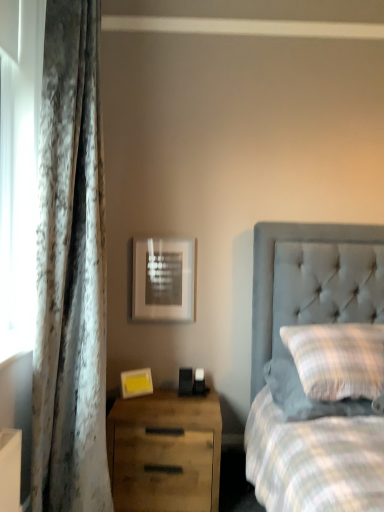
Question: Are matte silver picture frame at upper center, which ranks as the 2th picture frame in front-to-back order, and wooden drawer at lower left located far from each other?

Choices:
 (A) no
 (B) yes

Answer: (A)

Question: Does matte silver picture frame at upper center, the 1th picture frame when ordered from top to bottom, appear on the right side of wooden drawer at lower left?

Choices:
 (A) yes
 (B) no

Answer: (B)

Question: Is matte silver picture frame at upper center, which ranks as the 2th picture frame in front-to-back order, behind wooden drawer at lower left?

Choices:
 (A) yes
 (B) no

Answer: (A)

Question: Is matte silver picture frame at upper center, the 1th picture frame in the back-to-front sequence, at the left side of wooden drawer at lower left?

Choices:
 (A) no
 (B) yes

Answer: (B)

Question: Does matte silver picture frame at upper center, the 1th picture frame when ordered from top to bottom, have a greater width compared to wooden drawer at lower left?

Choices:
 (A) yes
 (B) no

Answer: (B)

Question: Is plaid fabric pillow at right spatially inside yellow matte picture frame at lower left, arranged as the 1th picture frame when viewed from the front, or outside of it?

Choices:
 (A) outside
 (B) inside

Answer: (A)

Question: Based on their positions, is plaid fabric pillow at right located to the left or right of yellow matte picture frame at lower left, acting as the first picture frame starting from the bottom?

Choices:
 (A) left
 (B) right

Answer: (B)

Question: From a real-world perspective, is plaid fabric pillow at right positioned above or below yellow matte picture frame at lower left, arranged as the 1th picture frame when viewed from the front?

Choices:
 (A) below
 (B) above

Answer: (B)

Question: Based on their sizes in the image, would you say plaid fabric pillow at right is bigger or smaller than yellow matte picture frame at lower left, acting as the first picture frame starting from the bottom?

Choices:
 (A) big
 (B) small

Answer: (A)

Question: From a real-world perspective, is matte silver picture frame at upper center, the 1th picture frame when ordered from top to bottom, above or below yellow matte picture frame at lower left, arranged as the 1th picture frame when viewed from the front?

Choices:
 (A) below
 (B) above

Answer: (B)

Question: From the image's perspective, is matte silver picture frame at upper center, which ranks as the 2th picture frame in front-to-back order, positioned above or below yellow matte picture frame at lower left, acting as the first picture frame starting from the bottom?

Choices:
 (A) below
 (B) above

Answer: (B)

Question: Considering the relative positions of matte silver picture frame at upper center, the 1th picture frame in the back-to-front sequence, and yellow matte picture frame at lower left, acting as the first picture frame starting from the bottom, in the image provided, is matte silver picture frame at upper center, the 1th picture frame in the back-to-front sequence, to the left or to the right of yellow matte picture frame at lower left, acting as the first picture frame starting from the bottom,?

Choices:
 (A) right
 (B) left

Answer: (A)

Question: Is matte silver picture frame at upper center, the 1th picture frame when ordered from top to bottom, wider or thinner than yellow matte picture frame at lower left, acting as the second picture frame starting from the back?

Choices:
 (A) thin
 (B) wide

Answer: (A)

Question: Is wooden drawer at lower left inside the boundaries of matte silver picture frame at upper center, the 1th picture frame in the back-to-front sequence, or outside?

Choices:
 (A) outside
 (B) inside

Answer: (A)

Question: Relative to matte silver picture frame at upper center, which ranks as the 2th picture frame in front-to-back order, is wooden drawer at lower left in front or behind?

Choices:
 (A) behind
 (B) front

Answer: (B)